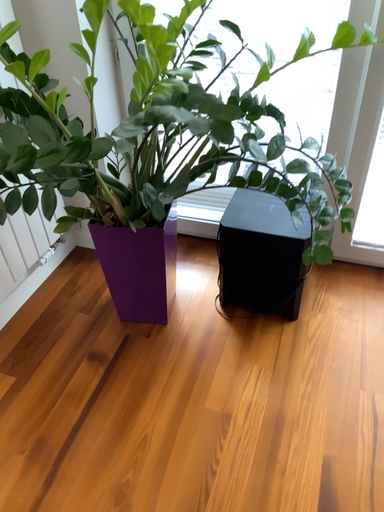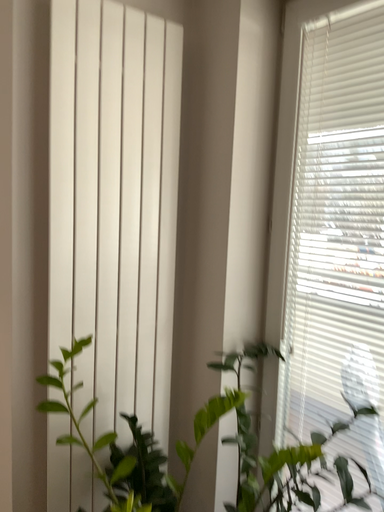
Question: How did the camera likely rotate when shooting the video?

Choices:
 (A) rotated right
 (B) rotated left

Answer: (B)